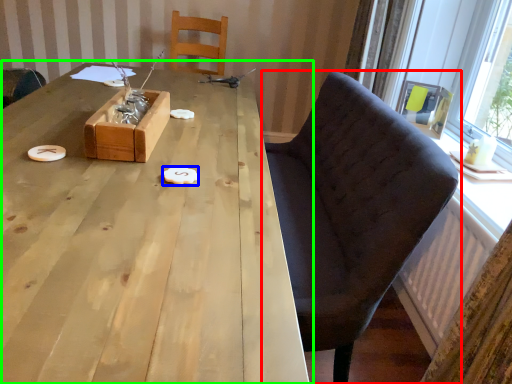
Question: Considering the real-world distances, which object is farthest from chair (highlighted by a red box)? food (highlighted by a blue box) or table (highlighted by a green box)?

Choices:
 (A) food
 (B) table

Answer: (A)